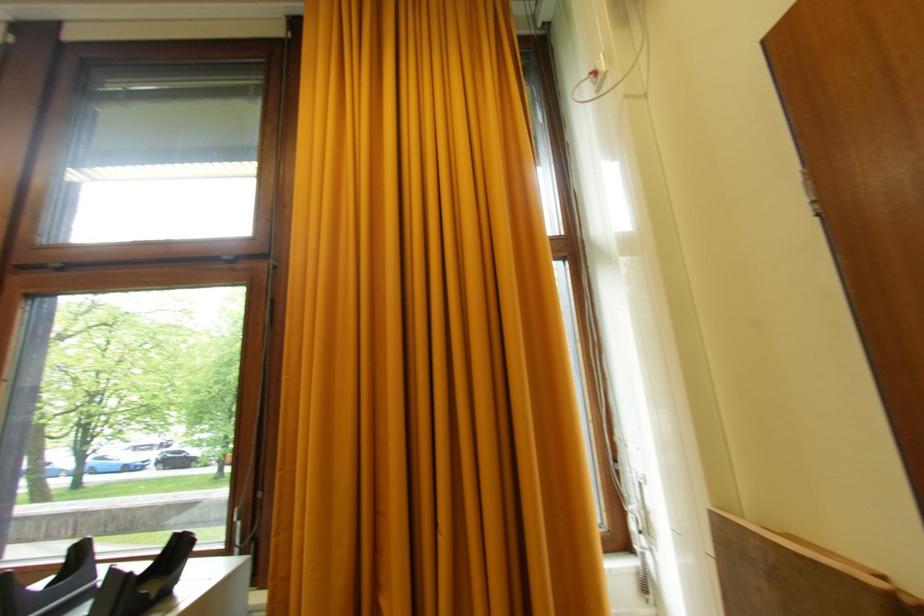
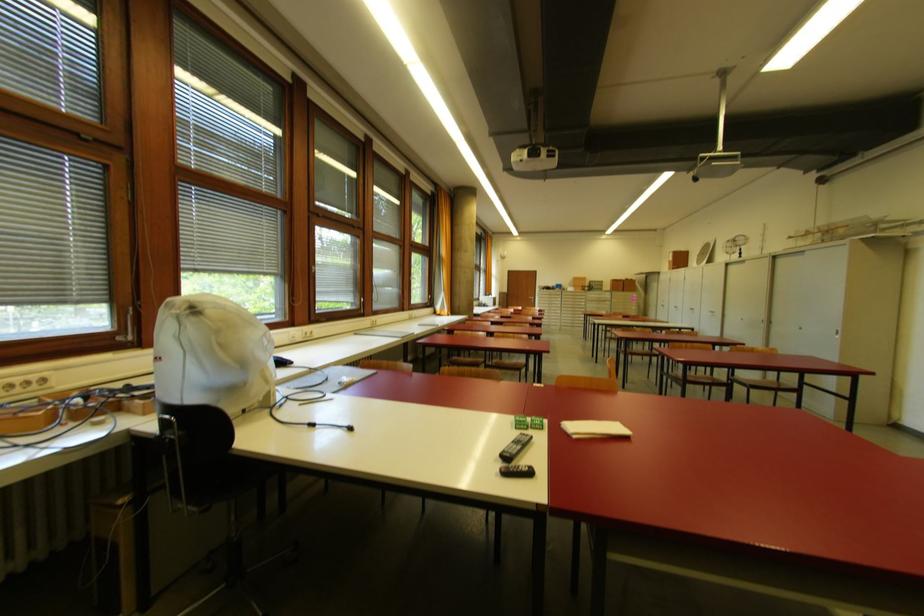
Question: I am providing you with two images of the same scene from different viewpoints. After the viewpoint changes to image2, which objects are now occluded?

Choices:
 (A) cardboard file holder
 (B) yellow curtain
 (C) cardboard box
 (D) black remote control

Answer: (B)